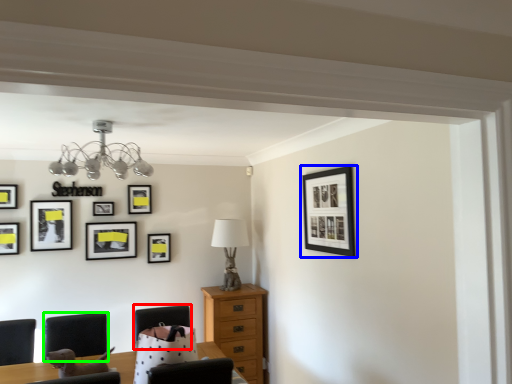
Question: Which object is the farthest from armchair (highlighted by a red box)? Choose among these: picture frame (highlighted by a blue box) or armchair (highlighted by a green box).

Choices:
 (A) picture frame
 (B) armchair

Answer: (A)